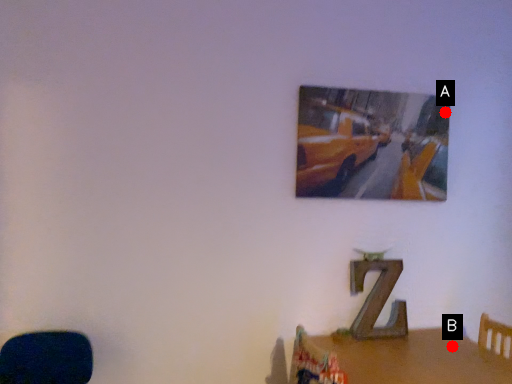
Question: Two points are circled on the image, labeled by A and B beside each circle. Which point appears closest to the camera in this image?

Choices:
 (A) A is closer
 (B) B is closer

Answer: (B)